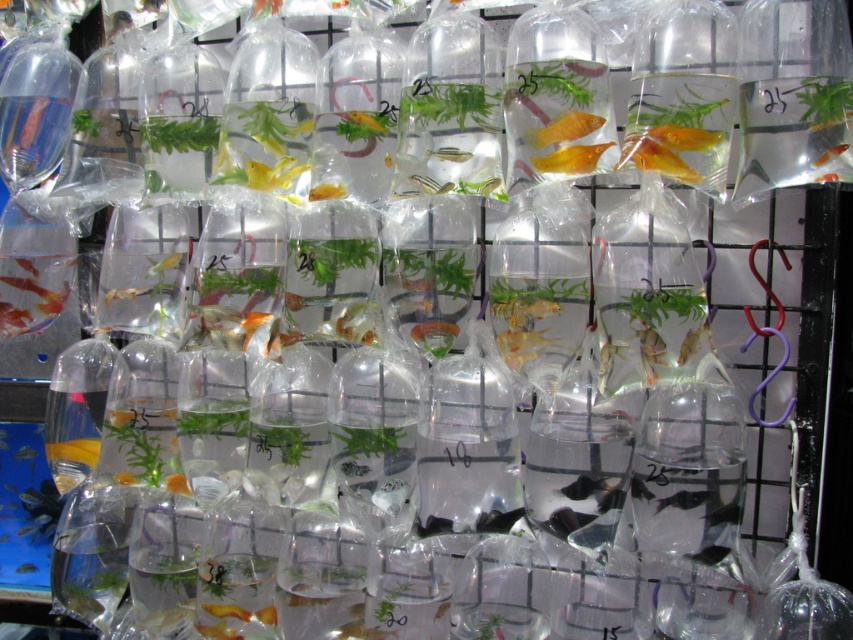
Can you confirm if translucent plastic goldfish at center is wider than translucent plastic fish at center?

Yes.

Which of these two, translucent plastic goldfish at center or translucent plastic fish at center, stands taller?

translucent plastic fish at center is taller.

Which is in front, point (433, 156) or point (413, 176)?

Positioned in front is point (433, 156).

Find the location of a particular element. The width and height of the screenshot is (853, 640). translucent plastic goldfish at center is located at coordinates (450, 154).